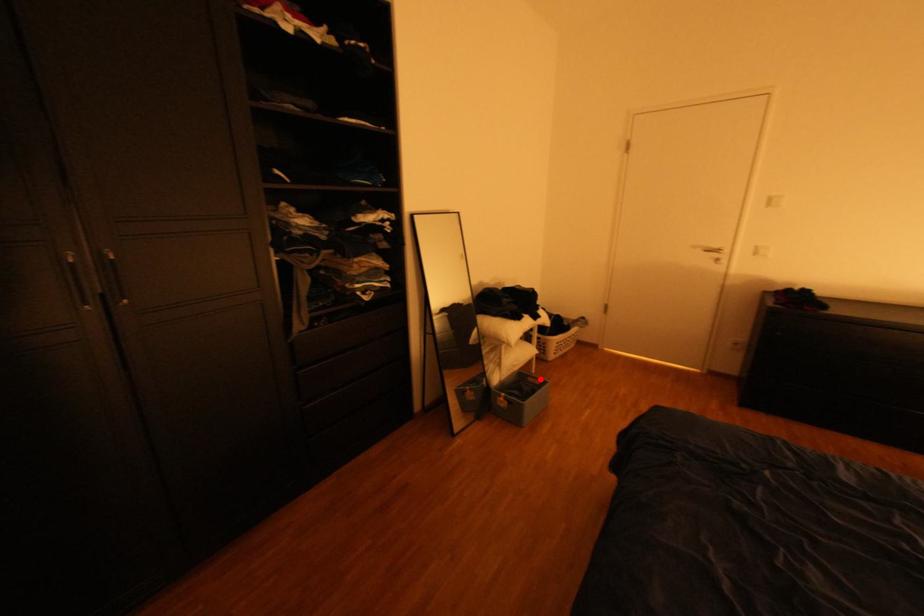
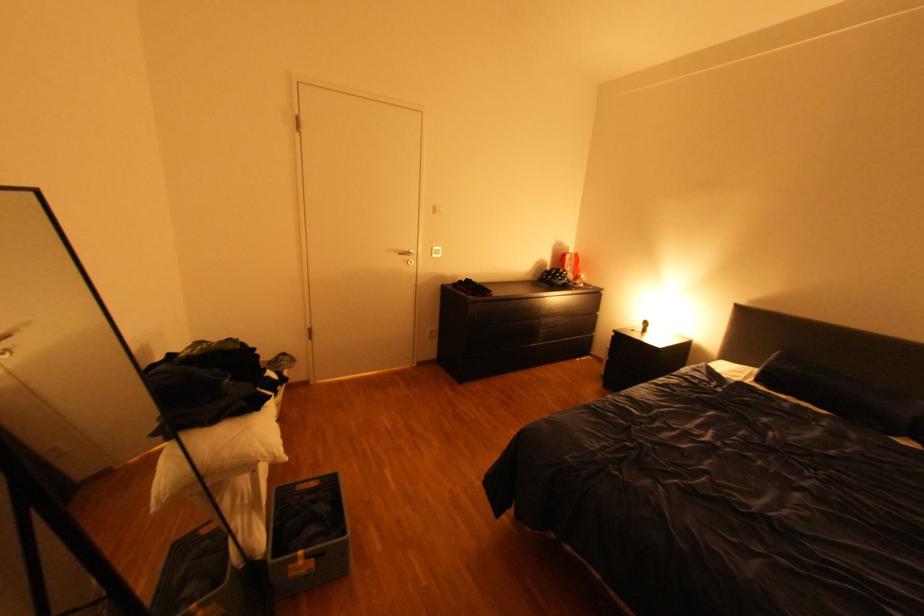
The point at the highlighted location is marked in the first image. Where is the corresponding point in the second image?

(310, 488)